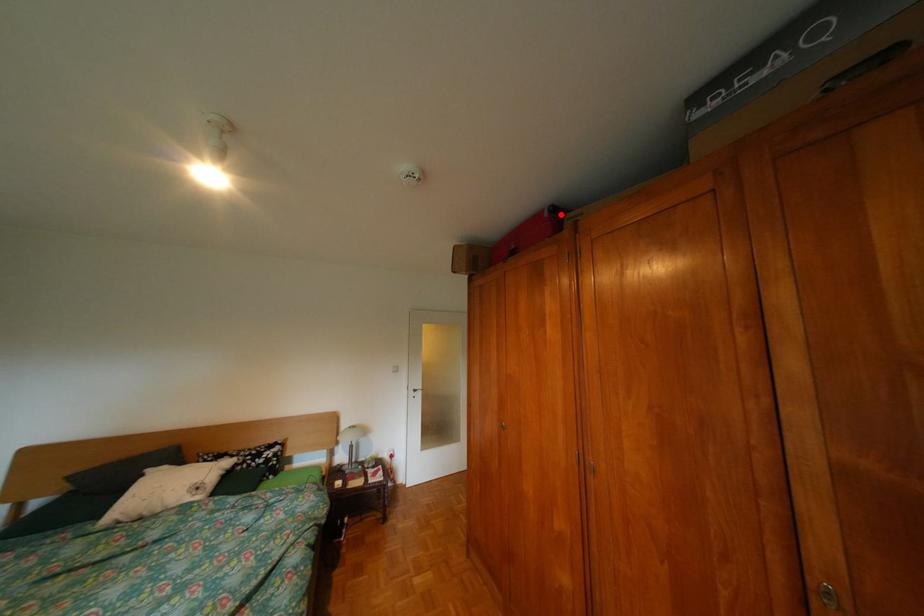
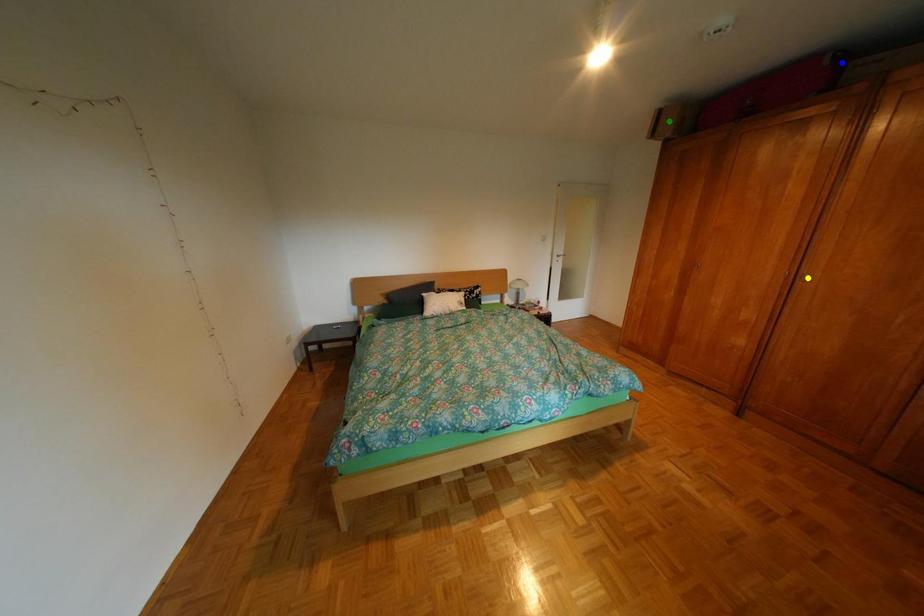
Question: I am providing you with two images of the same scene from different viewpoints. A red point is marked on the first image. You are given multiple points on the second image. In image 2, which mark is for the same physical point as the one in image 1?

Choices:
 (A) green point
 (B) yellow point
 (C) blue point

Answer: (C)